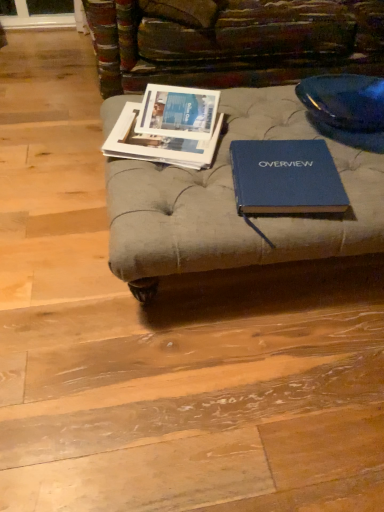
Question: Considering the relative sizes of blue hardcover book at center, the second book viewed from the left, and matte paper magazine at center in the image provided, is blue hardcover book at center, the second book viewed from the left, shorter than matte paper magazine at center?

Choices:
 (A) no
 (B) yes

Answer: (B)

Question: Could you tell me if blue hardcover book at center, the second book viewed from the left, is facing matte paper magazine at center?

Choices:
 (A) yes
 (B) no

Answer: (B)

Question: Is blue hardcover book at center, the second book viewed from the left, positioned beyond the bounds of matte paper magazine at center?

Choices:
 (A) yes
 (B) no

Answer: (A)

Question: From the image's perspective, is blue hardcover book at center, which is counted as the 1th book, starting from the right, over matte paper magazine at center?

Choices:
 (A) no
 (B) yes

Answer: (A)

Question: Does blue hardcover book at center, which is counted as the 1th book, starting from the right, have a smaller size compared to matte paper magazine at center?

Choices:
 (A) yes
 (B) no

Answer: (B)

Question: Is matte paper magazine at center completely or partially inside blue hardcover book at center, the second book viewed from the left?

Choices:
 (A) no
 (B) yes

Answer: (A)

Question: Is matte paper magazine at center far from blue hardcover book at center, the second book viewed from the left?

Choices:
 (A) no
 (B) yes

Answer: (A)

Question: Is matte paper magazine at center bigger than blue hardcover book at center, the second book viewed from the left?

Choices:
 (A) no
 (B) yes

Answer: (A)

Question: From a real-world perspective, is matte paper magazine at center beneath blue hardcover book at center, which is counted as the 1th book, starting from the right?

Choices:
 (A) yes
 (B) no

Answer: (B)

Question: Is matte paper magazine at center surrounding blue hardcover book at center, which is counted as the 1th book, starting from the right?

Choices:
 (A) yes
 (B) no

Answer: (B)

Question: Is matte paper magazine at center in front of blue hardcover book at center, which is counted as the 1th book, starting from the right?

Choices:
 (A) yes
 (B) no

Answer: (B)

Question: Is matte paper magazine at center thinner than blue hardcover book at center, which is counted as the 1th book, starting from the right?

Choices:
 (A) no
 (B) yes

Answer: (B)

Question: Is blue hardcover book at center, which is counted as the 1th book, starting from the right, facing towards matte paper magazines at center left, placed as the 2th book when sorted from right to left?

Choices:
 (A) no
 (B) yes

Answer: (A)